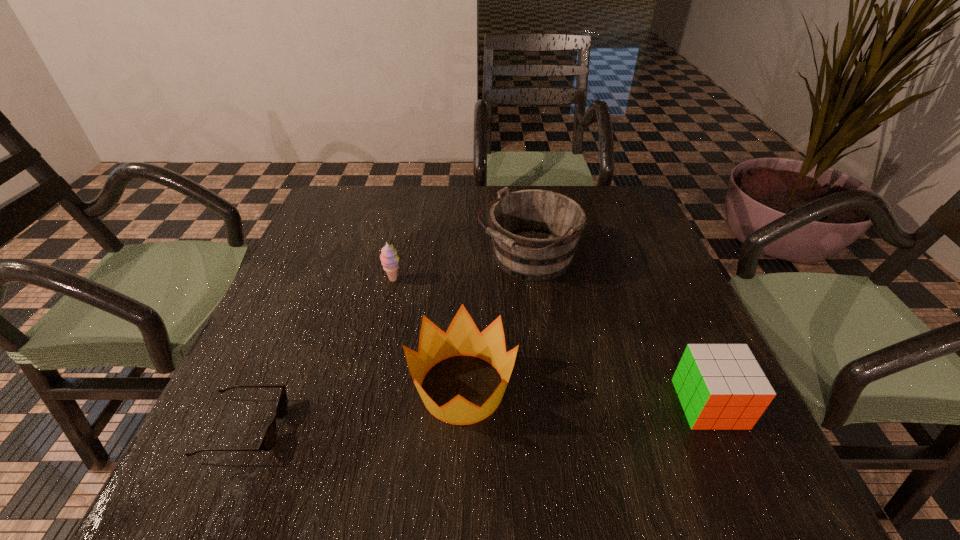
Find the location of a particular element. The image size is (960, 540). free space located 0.360m on the front lenses of the shortest object is located at coordinates (493, 428).

The image size is (960, 540). I want to click on object that is at the far edge, so click(535, 233).

Identify the location of object that is positioned at the near edge. The width and height of the screenshot is (960, 540). (269, 438).

The height and width of the screenshot is (540, 960). In order to click on object that is positioned at the left edge in this screenshot , I will do `click(269, 438)`.

In order to click on object located at the right edge in this screenshot , I will do `click(720, 386)`.

You are a GUI agent. You are given a task and a screenshot of the screen. Output one action in this format:
    pyautogui.click(x=<x>, y=<y>)
    Task: Click on the object at the near left corner
    This screenshot has height=540, width=960.
    Given the screenshot: What is the action you would take?
    pyautogui.click(x=269, y=438)

In the image, there is a desktop. Identify the location of free space at the far edge. The image size is (960, 540). (413, 198).

I want to click on vacant space at the near edge of the desktop, so click(613, 458).

Find the location of `vacant space at the left edge`. vacant space at the left edge is located at coordinates (273, 316).

Find the location of a particular element. vacant position at the right edge of the desktop is located at coordinates (602, 256).